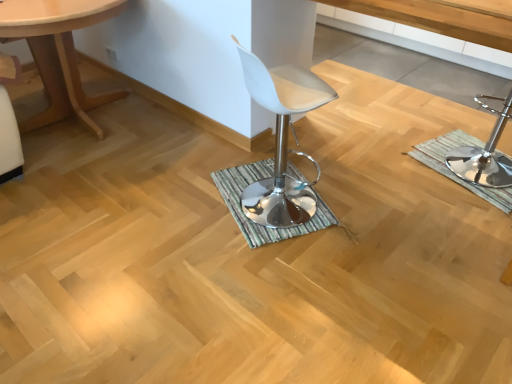
Where is `free spot behind white plastic stool at center`? The height and width of the screenshot is (384, 512). free spot behind white plastic stool at center is located at coordinates (386, 115).